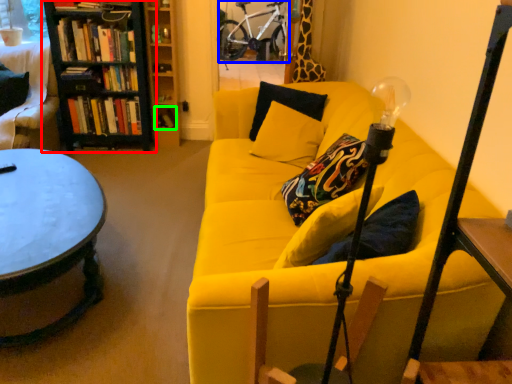
Question: Estimate the real-world distances between objects in this image. Which object is closer to bookcase (highlighted by a red box), bicycle (highlighted by a blue box) or book (highlighted by a green box)?

Choices:
 (A) bicycle
 (B) book

Answer: (B)